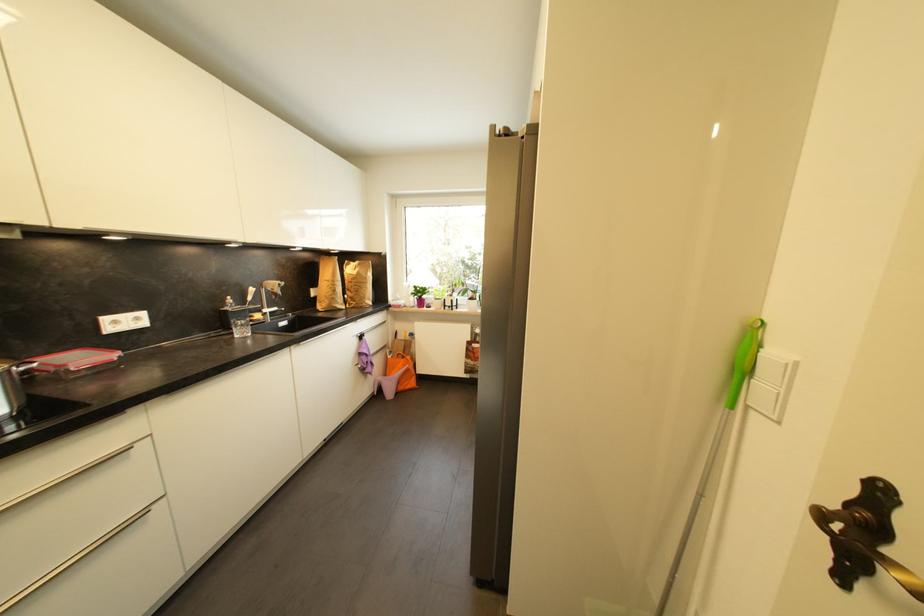
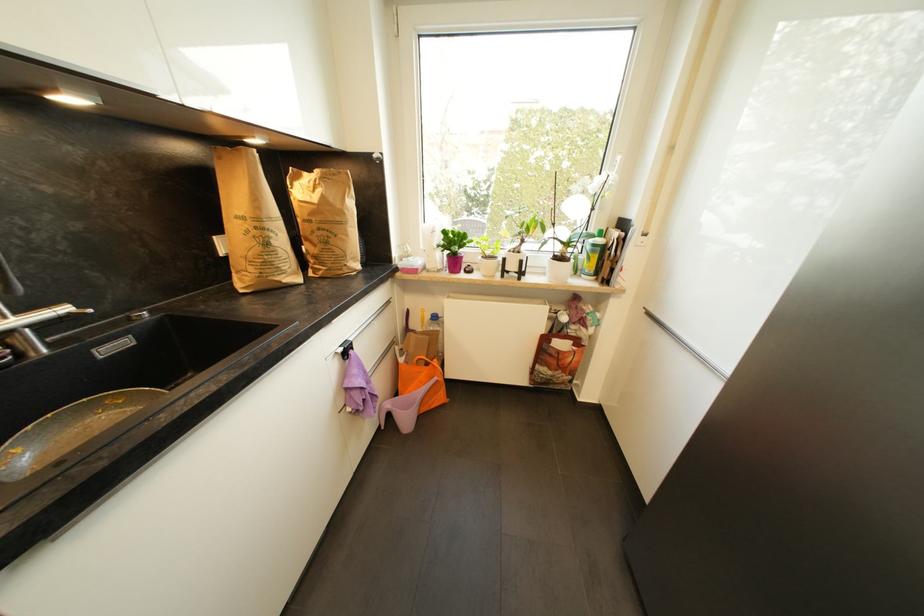
Based on the photo, what movement of the cameraman would produce the second image?

The cameraman walked toward left, forward.